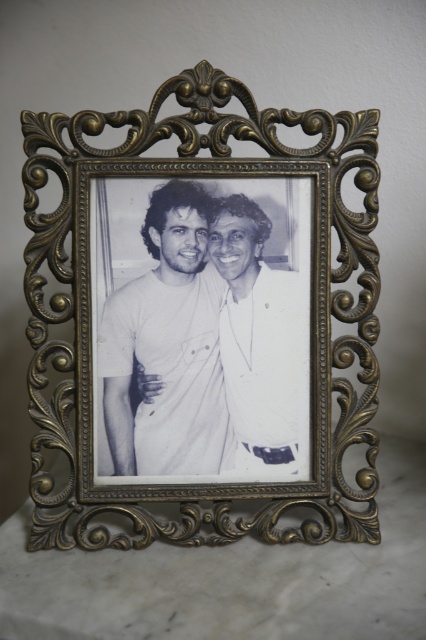
Does white paper photo at center have a lesser width compared to white matte shirt at center?

No.

Can you confirm if white paper photo at center is positioned above white matte shirt at center?

Indeed, white paper photo at center is positioned over white matte shirt at center.

Does point (161, 198) lie behind point (249, 268)?

No, (161, 198) is in front of (249, 268).

In order to click on white paper photo at center in this screenshot , I will do `click(210, 340)`.

Is white paper photo at center behind gold ornate frame at center?

Yes, it is.

Does point (189, 392) come farther from viewer compared to point (344, 381)?

No.

The height and width of the screenshot is (640, 426). Find the location of `white paper photo at center`. white paper photo at center is located at coordinates (210, 340).

Can you confirm if gold ornate frame at center is bigger than white matte shirt at center?

Yes, gold ornate frame at center is bigger than white matte shirt at center.

Does gold ornate frame at center appear on the left side of white matte shirt at center?

Indeed, gold ornate frame at center is positioned on the left side of white matte shirt at center.

Does point (373, 506) lie behind point (250, 422)?

Yes, it is.

Locate an element on the screen. This screenshot has width=426, height=640. gold ornate frame at center is located at coordinates (74, 305).